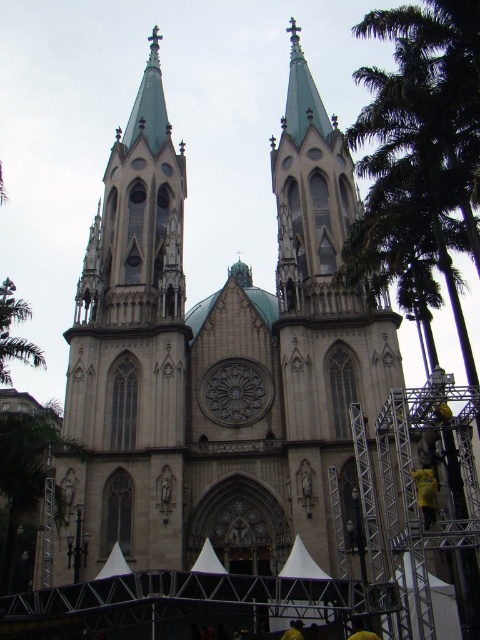
Question: Estimate the real-world distances between objects in this image. Which object is closer to the matte stone tower at center?

Choices:
 (A) green leafy tree at left
 (B) green leafy palm tree at right

Answer: (A)

Question: Can you confirm if green leafy palm tree at right is positioned below green leafy tree at left?

Choices:
 (A) yes
 (B) no

Answer: (B)

Question: Is matte stone tower at center thinner than green leafy tree at left?

Choices:
 (A) yes
 (B) no

Answer: (A)

Question: Is green leafy palm tree at right behind green leafy tree at left?

Choices:
 (A) yes
 (B) no

Answer: (B)

Question: Which of the following is the farthest from the observer?

Choices:
 (A) (456, 195)
 (B) (156, 376)
 (C) (8, 369)

Answer: (C)

Question: Which point appears closest to the camera in this image?

Choices:
 (A) (430, 13)
 (B) (148, 381)

Answer: (A)